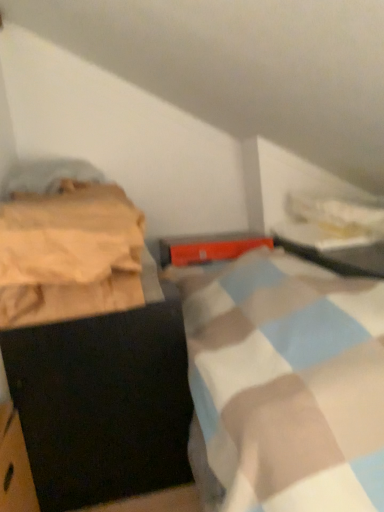
Question: Is metallic silver table at upper right facing away from beige cotton blanket at left?

Choices:
 (A) yes
 (B) no

Answer: (B)

Question: From a real-world perspective, is metallic silver table at upper right on top of beige cotton blanket at left?

Choices:
 (A) yes
 (B) no

Answer: (B)

Question: Does metallic silver table at upper right have a lesser width compared to beige cotton blanket at left?

Choices:
 (A) yes
 (B) no

Answer: (A)

Question: Is metallic silver table at upper right smaller than beige cotton blanket at left?

Choices:
 (A) no
 (B) yes

Answer: (A)

Question: Is metallic silver table at upper right in front of beige cotton blanket at left?

Choices:
 (A) yes
 (B) no

Answer: (B)

Question: Is metallic silver table at upper right not inside beige cotton blanket at left?

Choices:
 (A) no
 (B) yes

Answer: (B)

Question: Can you confirm if beige cotton blanket at left is positioned to the right of black matte cabinet at left?

Choices:
 (A) yes
 (B) no

Answer: (B)

Question: Is beige cotton blanket at left smaller than black matte cabinet at left?

Choices:
 (A) yes
 (B) no

Answer: (A)

Question: Can you confirm if beige cotton blanket at left is wider than black matte cabinet at left?

Choices:
 (A) no
 (B) yes

Answer: (A)

Question: From the image's perspective, would you say beige cotton blanket at left is shown under black matte cabinet at left?

Choices:
 (A) yes
 (B) no

Answer: (B)

Question: From a real-world perspective, is beige cotton blanket at left physically below black matte cabinet at left?

Choices:
 (A) no
 (B) yes

Answer: (A)

Question: Could you tell me if beige cotton blanket at left is turned towards black matte cabinet at left?

Choices:
 (A) yes
 (B) no

Answer: (B)

Question: Is beige cotton blanket at left oriented towards metallic silver table at upper right?

Choices:
 (A) yes
 (B) no

Answer: (B)